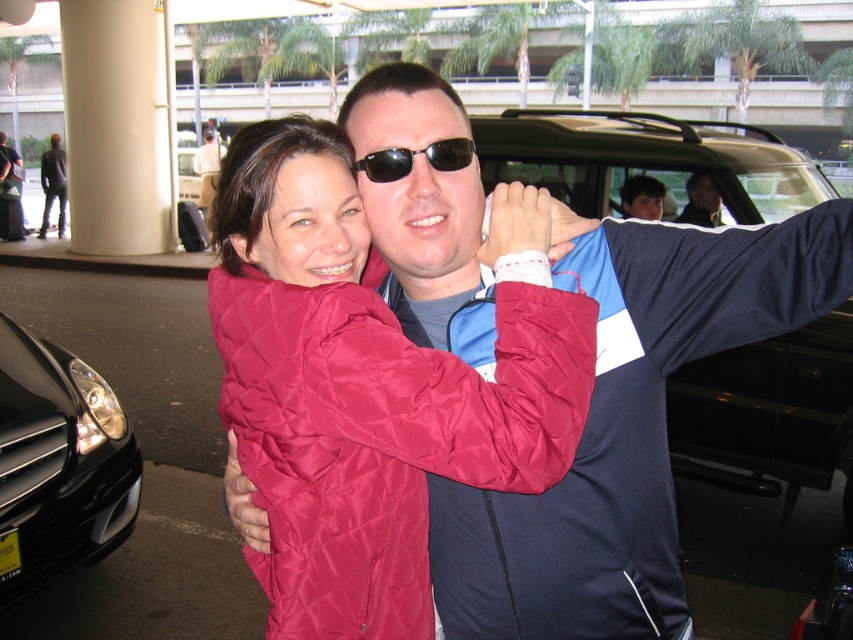
You are standing in a parking lot and see the quilted red jacket at center and the black matte car at right. Which object is nearer to you?

The quilted red jacket at center is closer to the viewer than the black matte car at right.